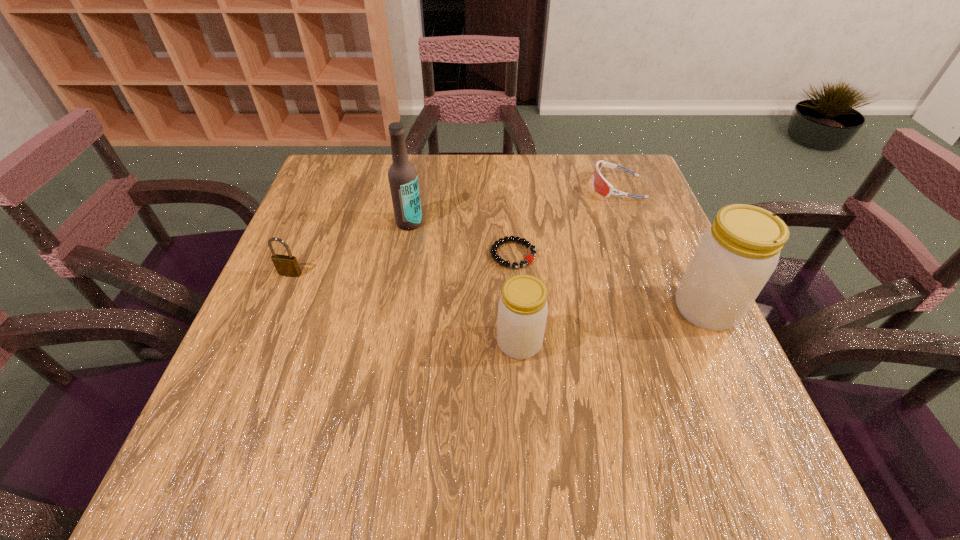
I want to click on the shortest object, so click(x=528, y=259).

Locate an element on the screen. This screenshot has height=540, width=960. free spot located on the right of the left jar is located at coordinates point(668,343).

Identify the location of vacant space positioned 0.320m on the left of the taller jar. (517, 309).

At what (x,y) coordinates should I click in order to perform the action: click on vacant space located 0.170m on the front-facing side of the goggles. Please return your answer as a coordinate pair (x, y). Image resolution: width=960 pixels, height=540 pixels. Looking at the image, I should click on (527, 187).

Locate an element on the screen. This screenshot has width=960, height=540. free space located on the front-facing side of the goggles is located at coordinates (450, 187).

Identify the location of vacant area located on the front-facing side of the goggles. (524, 187).

The width and height of the screenshot is (960, 540). I want to click on free space located 0.320m on the side of the beer bottle with the label, so click(389, 339).

You are a GUI agent. You are given a task and a screenshot of the screen. Output one action in this format:
    pyautogui.click(x=<x>, y=<y>)
    Task: Click on the vacant region located on the front of the fourth tallest object
    
    Given the screenshot: What is the action you would take?
    pyautogui.click(x=231, y=414)

You are a GUI agent. You are given a task and a screenshot of the screen. Output one action in this format:
    pyautogui.click(x=<x>, y=<y>)
    Task: Click on the free space located 0.280m on the right of the shortest object
    This screenshot has width=960, height=540.
    Given the screenshot: What is the action you would take?
    pyautogui.click(x=659, y=255)

Identify the location of object situated at the far edge. The width and height of the screenshot is (960, 540). (600, 184).